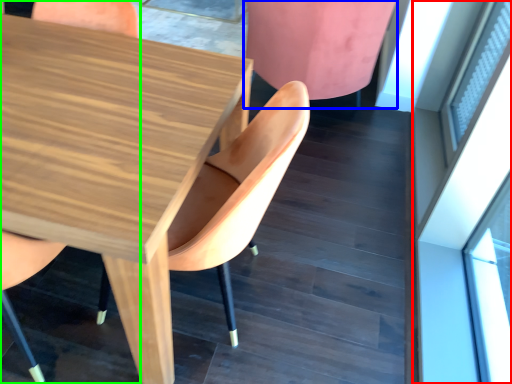
Question: Which is farther away from glass door (highlighted by a red box)? chair (highlighted by a blue box) or chair (highlighted by a green box)?

Choices:
 (A) chair
 (B) chair

Answer: (B)